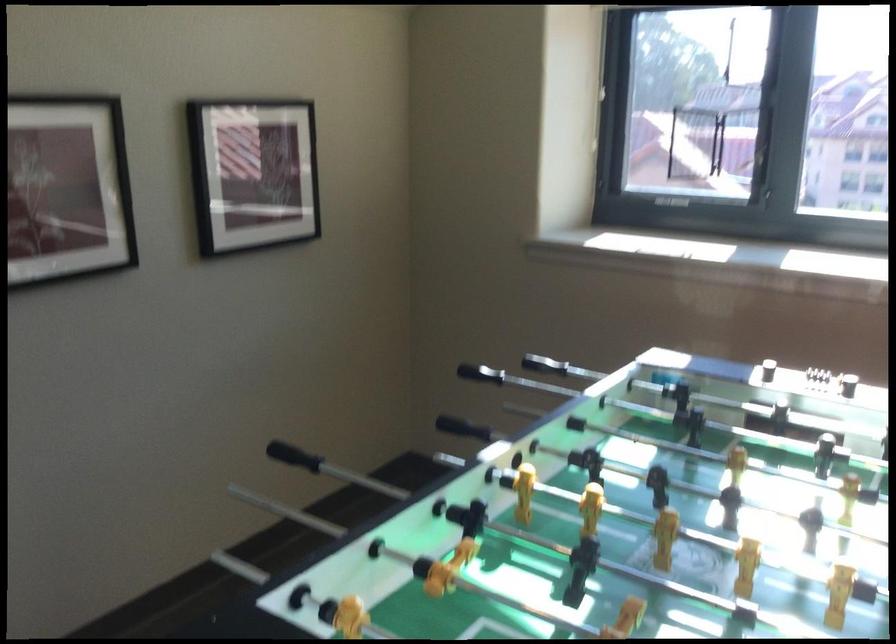
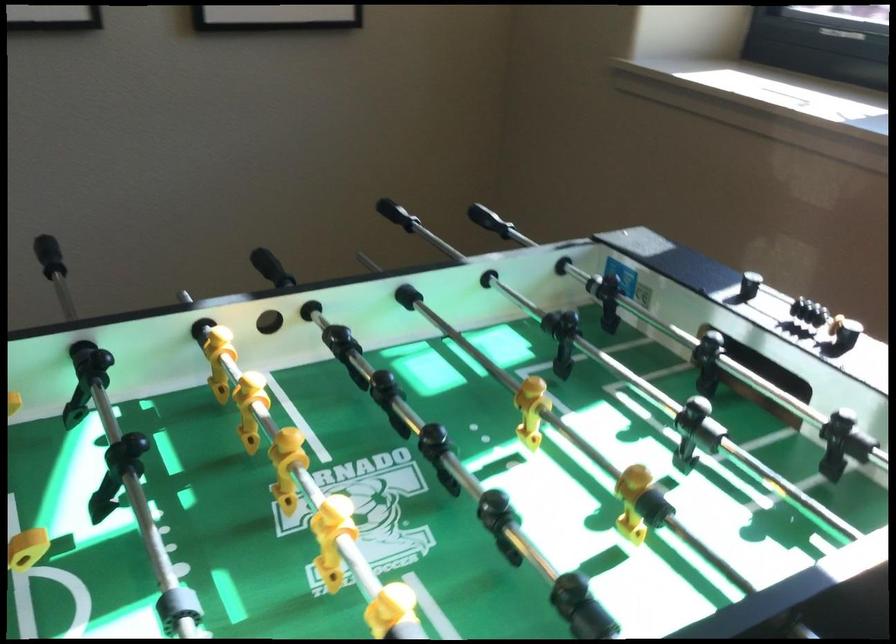
Question: How did the camera likely rotate?

Choices:
 (A) Left
 (B) Right
 (C) Up
 (D) Down

Answer: (A)